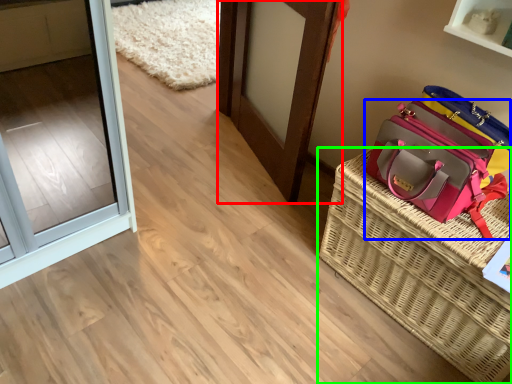
Question: Considering the real-world distances, which object is closest to door (highlighted by a red box)? handbag (highlighted by a blue box) or picnic basket (highlighted by a green box).

Choices:
 (A) handbag
 (B) picnic basket

Answer: (A)